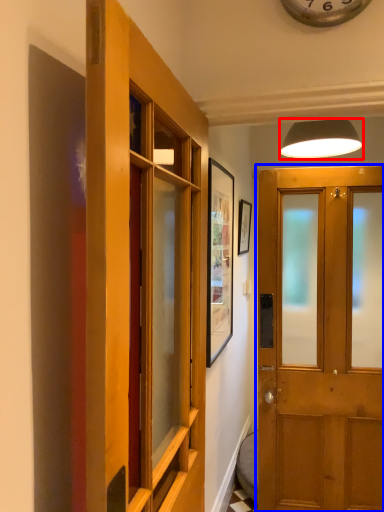
Question: Among these objects, which one is farthest to the camera, lamp (highlighted by a red box) or door (highlighted by a blue box)?

Choices:
 (A) lamp
 (B) door

Answer: (A)